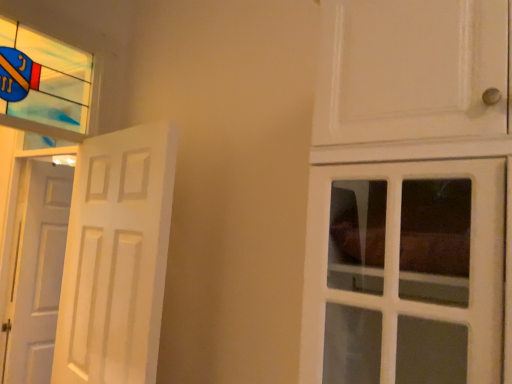
Question: Does white matte door at left, arranged as the 1th door when viewed from the left, lie behind stained glass window at upper left?

Choices:
 (A) yes
 (B) no

Answer: (A)

Question: Is stained glass window at upper left at the back of white matte door at left, the second door viewed from the front?

Choices:
 (A) no
 (B) yes

Answer: (A)

Question: Is white matte door at left, arranged as the 1th door when viewed from the left, smaller than stained glass window at upper left?

Choices:
 (A) no
 (B) yes

Answer: (A)

Question: Does white matte door at left, arranged as the 1th door when viewed from the left, have a greater height compared to stained glass window at upper left?

Choices:
 (A) yes
 (B) no

Answer: (A)

Question: From the image's perspective, is white matte door at left, arranged as the 1th door when viewed from the left, below stained glass window at upper left?

Choices:
 (A) yes
 (B) no

Answer: (A)

Question: Is white matte door at left, the second door positioned from the right, wider than stained glass window at upper left?

Choices:
 (A) yes
 (B) no

Answer: (B)

Question: Is stained glass window at upper left beside white matte door at left, arranged as the 1th door when viewed from the left?

Choices:
 (A) yes
 (B) no

Answer: (B)

Question: From the image's perspective, is stained glass window at upper left located above white matte door at left, the second door viewed from the front?

Choices:
 (A) yes
 (B) no

Answer: (A)

Question: Can you confirm if stained glass window at upper left is wider than white matte door at left, arranged as the 1th door when viewed from the back?

Choices:
 (A) no
 (B) yes

Answer: (B)

Question: Can you confirm if stained glass window at upper left is shorter than white matte door at left, the second door viewed from the front?

Choices:
 (A) no
 (B) yes

Answer: (B)

Question: Is stained glass window at upper left smaller than white matte door at left, the second door viewed from the front?

Choices:
 (A) no
 (B) yes

Answer: (B)

Question: Is white matte door at left, arranged as the 1th door when viewed from the back, a part of stained glass window at upper left?

Choices:
 (A) yes
 (B) no

Answer: (B)

Question: Considering the relative sizes of white matte door at left, arranged as the 1th door when viewed from the back, and white matte door at left, placed as the second door when sorted from left to right, in the image provided, is white matte door at left, arranged as the 1th door when viewed from the back, shorter than white matte door at left, placed as the second door when sorted from left to right,?

Choices:
 (A) no
 (B) yes

Answer: (A)